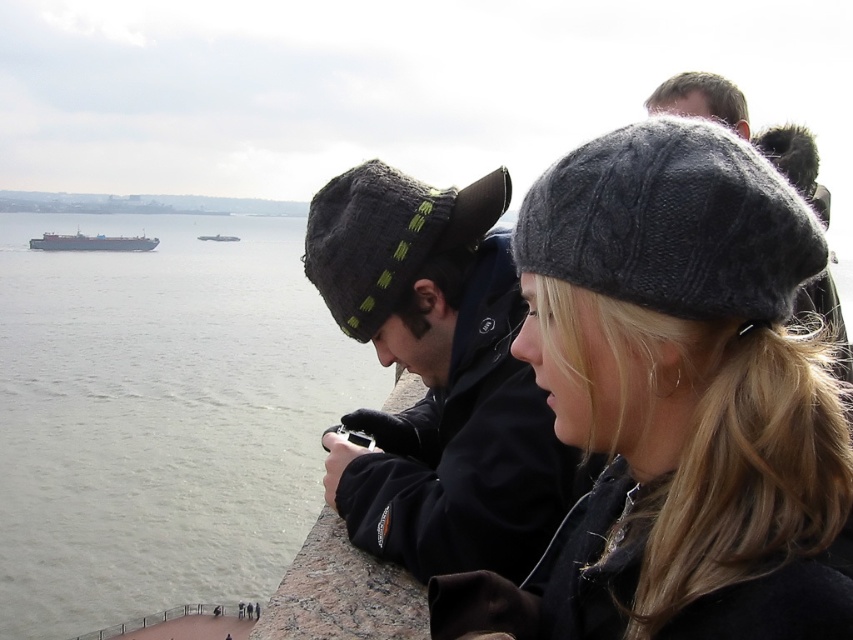
You are standing at the waterfront and see the knitted gray hat at center and the metallic gray ship at left. Which object is positioned to the right of the other?

The knitted gray hat at center is to the right of the metallic gray ship at left.

You are a photographer trying to capture both the knitted gray hat at center and the dark gray knit hat at center in a single shot. Which hat will appear smaller in the photo?

The knitted gray hat at center will appear smaller in the photo because its width is less than the dark gray knit hat at center.